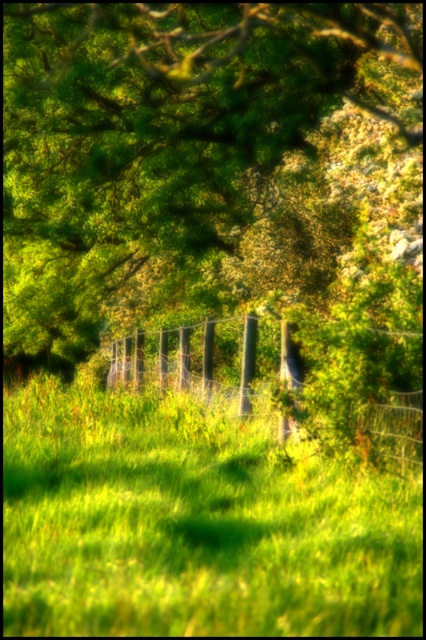
Question: Does green grassy at center come behind metallic wire fence at center?

Choices:
 (A) no
 (B) yes

Answer: (B)

Question: Which of the following is the farthest from the observer?

Choices:
 (A) (376, 449)
 (B) (117, 104)

Answer: (B)

Question: Which of the following is the farthest from the observer?

Choices:
 (A) (51, 262)
 (B) (253, 324)
 (C) (281, 435)
 (D) (126, 468)

Answer: (A)

Question: Considering the relative positions of metallic wire fence at center and smooth black pole at center in the image provided, where is metallic wire fence at center located with respect to smooth black pole at center?

Choices:
 (A) right
 (B) left

Answer: (B)

Question: Is green leafy tree at upper center positioned in front of smooth black pole at center?

Choices:
 (A) yes
 (B) no

Answer: (B)

Question: Which is nearer to the green leafy tree at upper center?

Choices:
 (A) metallic wire fence at center
 (B) green grassy at center

Answer: (A)